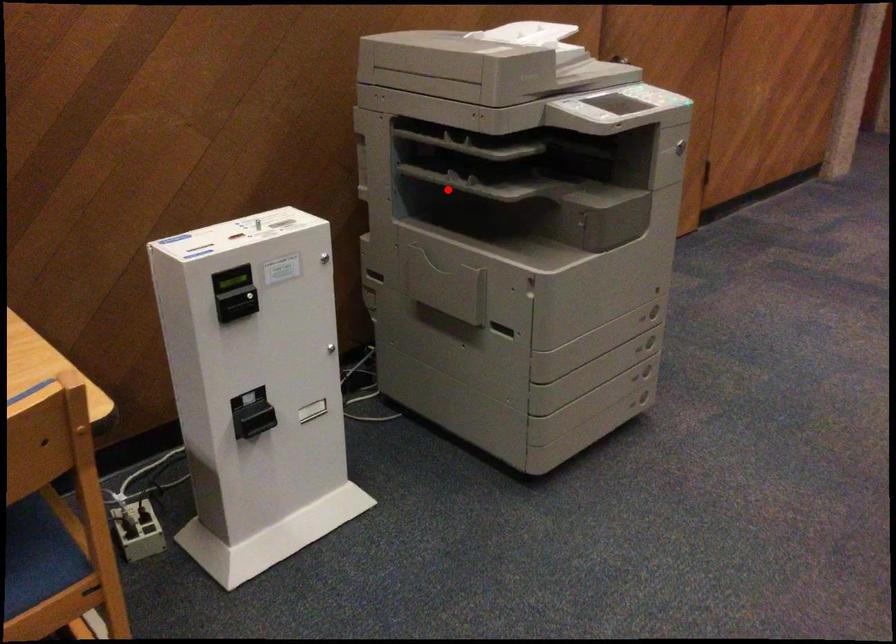
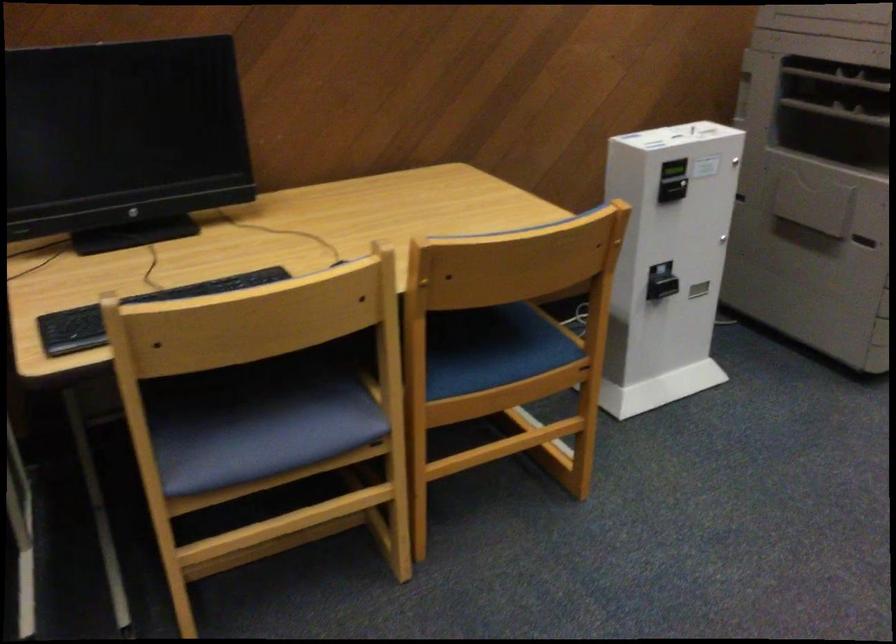
Locate, in the second image, the point that corresponds to the highlighted location in the first image.

(836, 111)